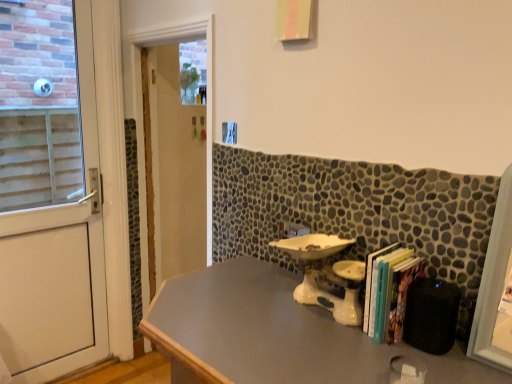
The height and width of the screenshot is (384, 512). I want to click on vacant space underneath white ceramic sink at center (from a real-world perspective), so click(311, 309).